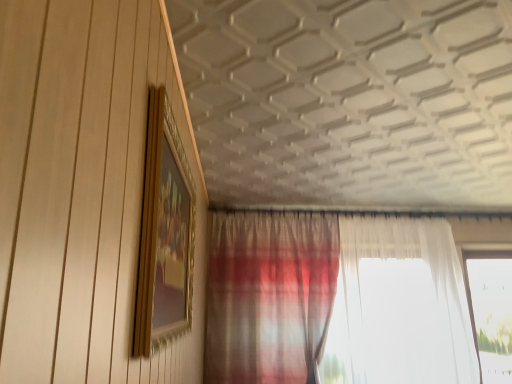
Question: Could you tell me if transparent glass window at right is turned towards plaid fabric curtain at lower center?

Choices:
 (A) no
 (B) yes

Answer: (A)

Question: Is plaid fabric curtain at lower center located within transparent glass window at right?

Choices:
 (A) yes
 (B) no

Answer: (B)

Question: Can we say transparent glass window at right lies outside plaid fabric curtain at lower center?

Choices:
 (A) yes
 (B) no

Answer: (A)

Question: Is transparent glass window at right taller than plaid fabric curtain at lower center?

Choices:
 (A) yes
 (B) no

Answer: (B)

Question: Is transparent glass window at right looking in the opposite direction of plaid fabric curtain at lower center?

Choices:
 (A) no
 (B) yes

Answer: (A)

Question: In terms of size, does plaid fabric curtain at lower center appear bigger or smaller than gold/gilded picture frame at upper left?

Choices:
 (A) small
 (B) big

Answer: (B)

Question: Is plaid fabric curtain at lower center wider or thinner than gold/gilded picture frame at upper left?

Choices:
 (A) wide
 (B) thin

Answer: (A)

Question: From the image's perspective, is plaid fabric curtain at lower center above or below gold/gilded picture frame at upper left?

Choices:
 (A) below
 (B) above

Answer: (A)

Question: Is plaid fabric curtain at lower center inside the boundaries of gold/gilded picture frame at upper left, or outside?

Choices:
 (A) inside
 (B) outside

Answer: (B)

Question: In terms of size, does transparent glass window at right appear bigger or smaller than plaid fabric curtain at lower center?

Choices:
 (A) small
 (B) big

Answer: (A)

Question: Is transparent glass window at right to the left or to the right of plaid fabric curtain at lower center in the image?

Choices:
 (A) left
 (B) right

Answer: (B)

Question: Looking at their shapes, would you say transparent glass window at right is wider or thinner than plaid fabric curtain at lower center?

Choices:
 (A) wide
 (B) thin

Answer: (B)

Question: From a real-world perspective, is transparent glass window at right physically located above or below plaid fabric curtain at lower center?

Choices:
 (A) above
 (B) below

Answer: (B)

Question: Considering their positions, is transparent glass window at right located in front of or behind gold/gilded picture frame at upper left?

Choices:
 (A) front
 (B) behind

Answer: (B)

Question: Is transparent glass window at right to the left or to the right of gold/gilded picture frame at upper left in the image?

Choices:
 (A) right
 (B) left

Answer: (A)